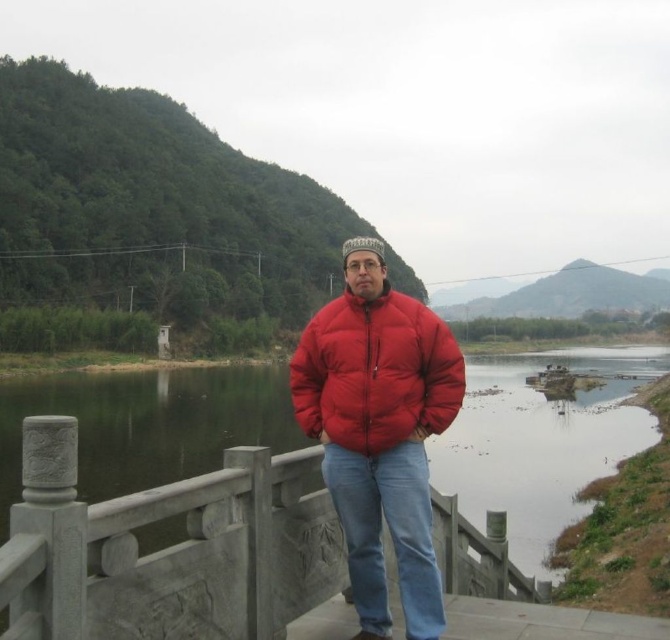
You are a photographer trying to capture the gray stone railing at center and the red puffy jacket at center in the same frame. Based on their positions, which object should you focus on first to ensure both are in sharp focus?

You should focus on the gray stone railing at center first because it is closer to the viewer than the red puffy jacket at center, ensuring both will be in focus when using a shallow depth of field.